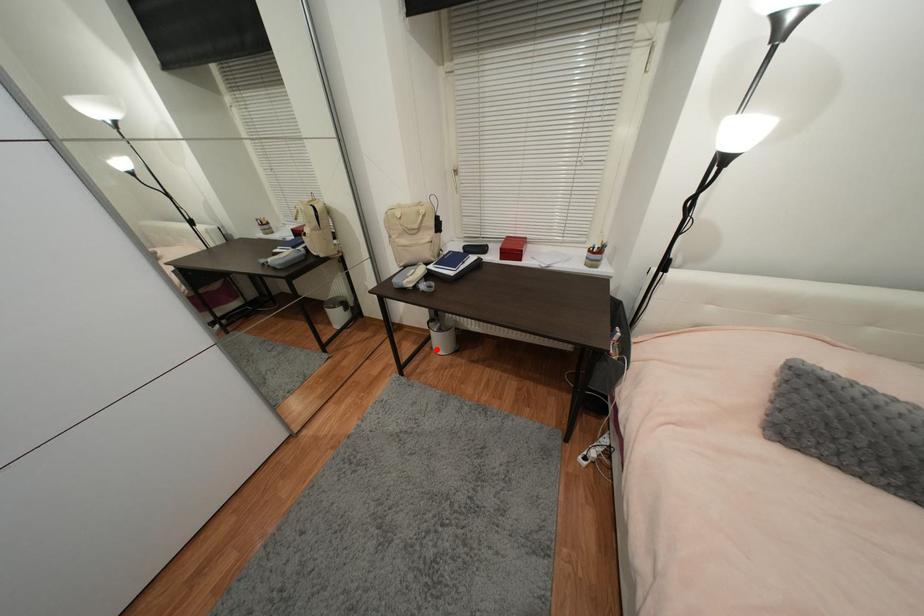
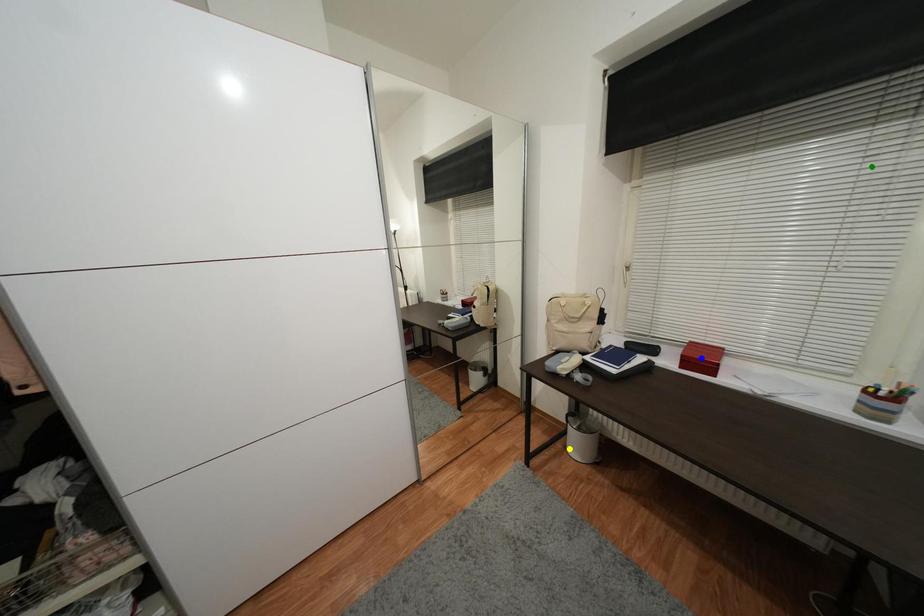
Question: I am providing you with two images of the same scene from different viewpoints. A red point is marked on the first image. You are given multiple points on the second image. Can you choose the point in image 2 that corresponds to the point in image 1?

Choices:
 (A) blue point
 (B) yellow point
 (C) green point

Answer: (B)